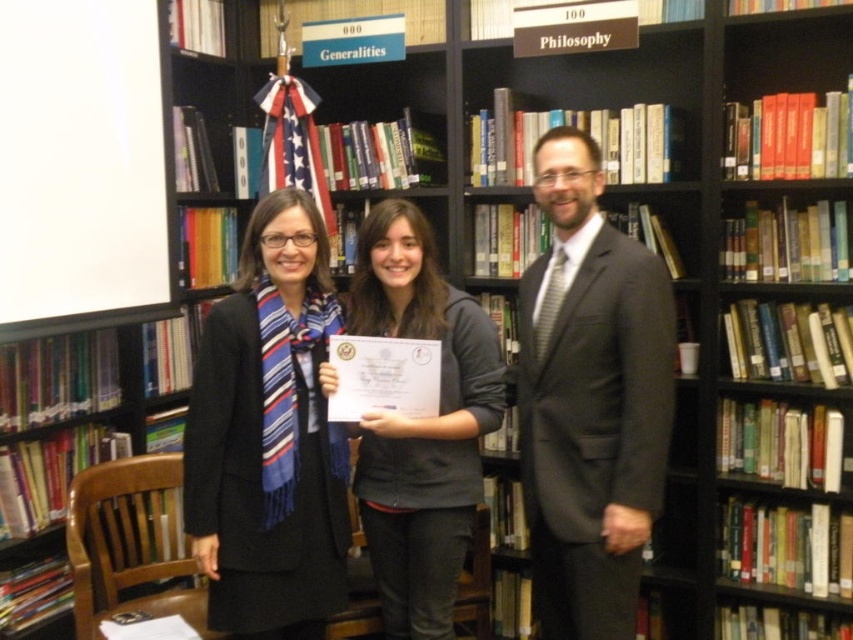
Can you confirm if gray suit at center is thinner than gray fabric jacket at center?

Yes, gray suit at center is thinner than gray fabric jacket at center.

Can you confirm if gray suit at center is bigger than gray fabric jacket at center?

Yes.

Is point (670, 336) in front of point (393, 451)?

That is True.

You are a GUI agent. You are given a task and a screenshot of the screen. Output one action in this format:
    pyautogui.click(x=<x>, y=<y>)
    Task: Click on the gray suit at center
    Image resolution: width=853 pixels, height=640 pixels.
    Given the screenshot: What is the action you would take?
    590,400

Does black wool coat at center appear over gray fabric jacket at center?

Correct, black wool coat at center is located above gray fabric jacket at center.

Can you confirm if black wool coat at center is smaller than gray fabric jacket at center?

Yes, black wool coat at center is smaller than gray fabric jacket at center.

What do you see at coordinates (270, 436) in the screenshot?
I see `black wool coat at center` at bounding box center [270, 436].

I want to click on black wool coat at center, so click(270, 436).

In the scene shown: Which is more to the left, gray suit at center or black wool coat at center?

black wool coat at center is more to the left.

Looking at this image, between gray suit at center and black wool coat at center, which one is positioned lower?

black wool coat at center

Locate an element on the screen. gray suit at center is located at coordinates pyautogui.click(x=590, y=400).